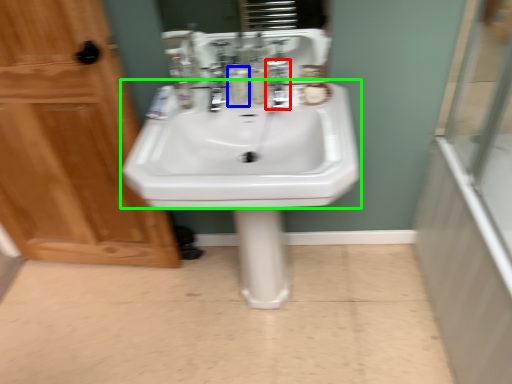
Question: Which object is the farthest from plumbing fixture (highlighted by a red box)? Choose among these: mouthwash (highlighted by a blue box) or sink (highlighted by a green box).

Choices:
 (A) mouthwash
 (B) sink

Answer: (B)